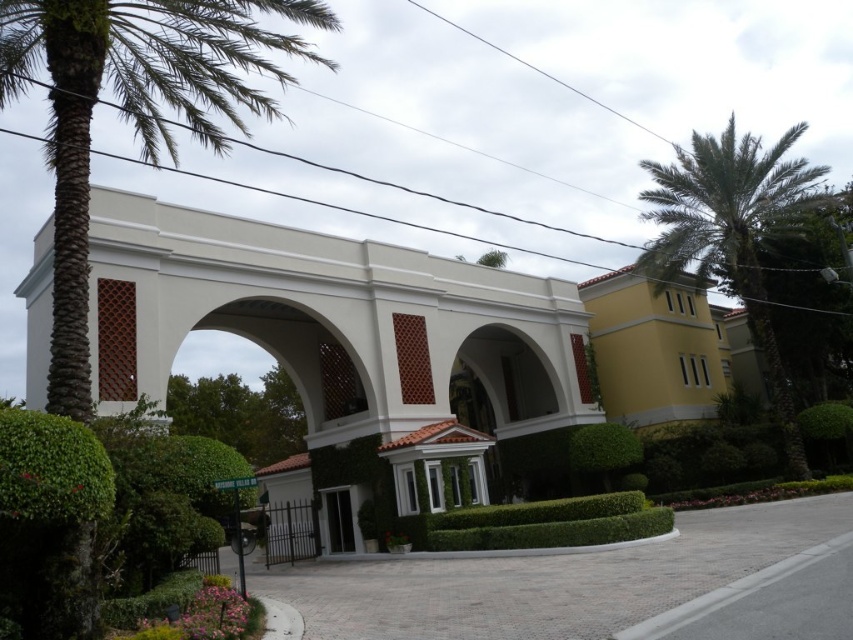
Is point (289, 296) closer to viewer compared to point (694, 157)?

Yes, point (289, 296) is closer to viewer.

From the picture: Can you confirm if white concrete archway at center is positioned to the right of green leafy palm tree at upper right?

In fact, white concrete archway at center is to the left of green leafy palm tree at upper right.

From the picture: Who is more distant from viewer, (97,195) or (752,268)?

The point (752,268) is more distant.

Locate an element on the screen. The height and width of the screenshot is (640, 853). white concrete archway at center is located at coordinates (337, 333).

Who is shorter, green leafy palm tree at left or green leafy hedge at center?

Standing shorter between the two is green leafy hedge at center.

Is point (206, 20) positioned after point (613, 518)?

No, (206, 20) is closer to viewer.

Which is behind, point (61, 336) or point (552, 531)?

The point (552, 531) is more distant.

This screenshot has width=853, height=640. Find the location of `green leafy palm tree at left`. green leafy palm tree at left is located at coordinates (132, 112).

Between green leafy hedge at center and black glass door at center, which one has more height?

With more height is black glass door at center.

Between green leafy hedge at center and black glass door at center, which one is positioned lower?

Positioned lower is black glass door at center.

Where is `green leafy hedge at center`? This screenshot has height=640, width=853. green leafy hedge at center is located at coordinates (549, 524).